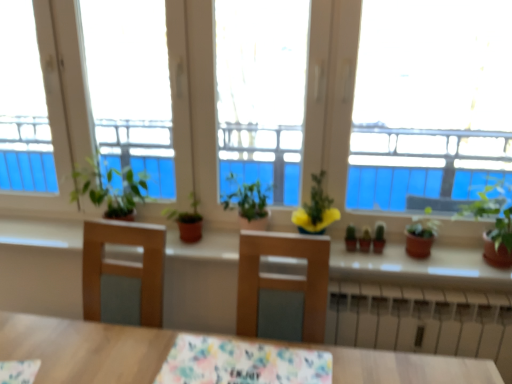
You are a GUI agent. You are given a task and a screenshot of the screen. Output one action in this format:
    pyautogui.click(x=<x>, y=<y>)
    Task: Click on the vacant space in green matte plant at center, the first houseplant when ordered from left to right (from a real-world perspective)
    The image size is (512, 384).
    Given the screenshot: What is the action you would take?
    pyautogui.click(x=183, y=243)